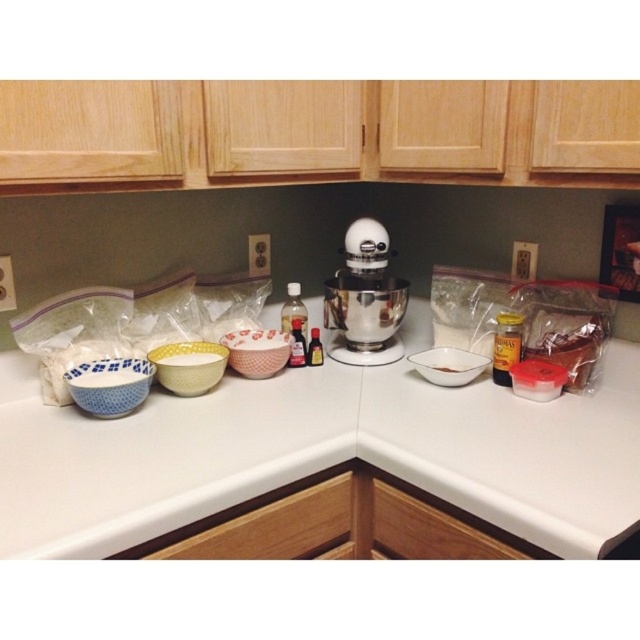
You are preparing to mix ingredients for a cake and need to choose a bowl that can hold more volume. Based on the image, which bowl should you select between the yellow polka dot bowl at center and the pink floral ceramic mixing bowl at center?

The yellow polka dot bowl at center has a larger width than the pink floral ceramic mixing bowl at center, so it can hold more volume.

You are a baker preparing ingredients for a recipe. You need to place the pink floral ceramic mixing bowl at center and the blue speckled ceramic bowl at left close to each other. How far apart are they?

The pink floral ceramic mixing bowl at center is 12.23 inches away from the blue speckled ceramic bowl at left, so they are 12.23 inches apart.